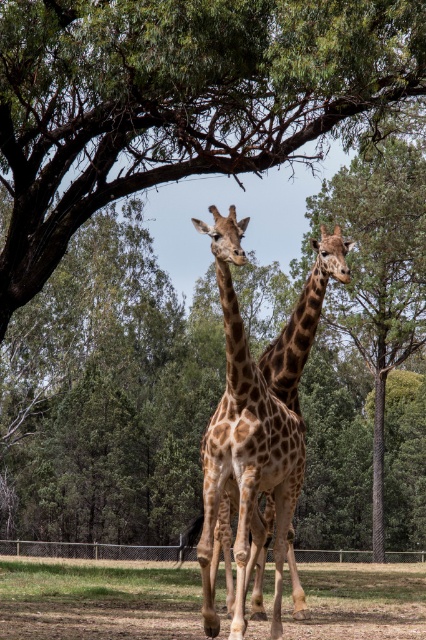
You are standing in front of the enclosure with the two giraffes. There are two points marked in the image, one at coordinate point [184,132] and another at point [114,563]. If you want to take a photo that captures both points clearly, which point should you focus on first to ensure depth of field?

You should focus on point [114,563] first because it is farther from the camera than point [184,132]. By focusing on the farther point, the closer point will also be in focus due to the depth of field range.